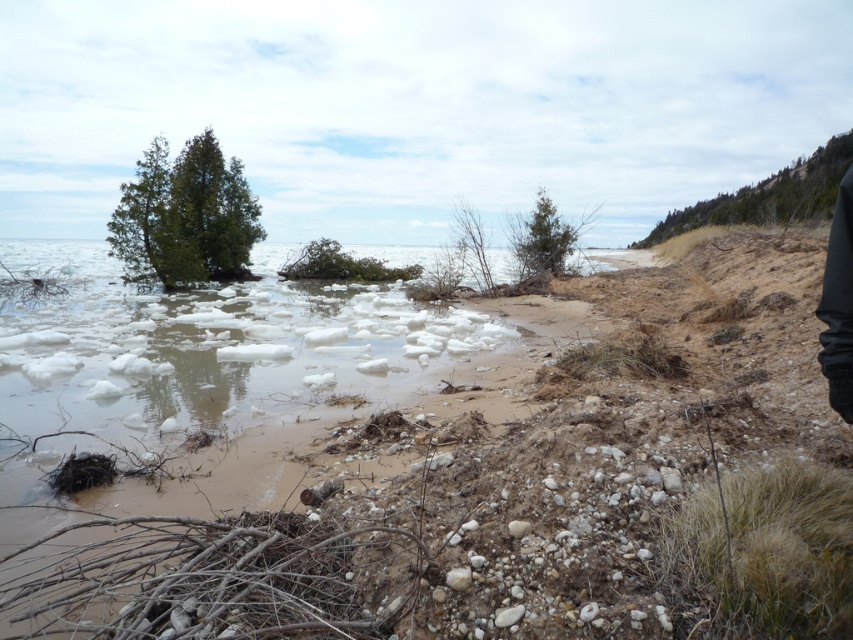
Question: Does green textured tree at upper right have a lesser width compared to green leafy bush at center?

Choices:
 (A) yes
 (B) no

Answer: (B)

Question: Which point appears farthest from the camera in this image?

Choices:
 (A) (804, 193)
 (B) (186, 205)
 (C) (316, 240)
 (D) (544, 248)

Answer: (A)

Question: Which of the following is the closest to the observer?

Choices:
 (A) green textured tree at upper right
 (B) green leafy bush at center

Answer: (A)

Question: Does green coniferous tree at center-left appear on the left side of green textured tree at upper right?

Choices:
 (A) yes
 (B) no

Answer: (A)

Question: Which is nearer to the green matte tree at upper center?

Choices:
 (A) green leafy bush at center
 (B) green textured tree at upper right
 (C) green coniferous tree at center-left

Answer: (A)

Question: Does green textured tree at upper right have a smaller size compared to green leafy bush at center?

Choices:
 (A) yes
 (B) no

Answer: (B)